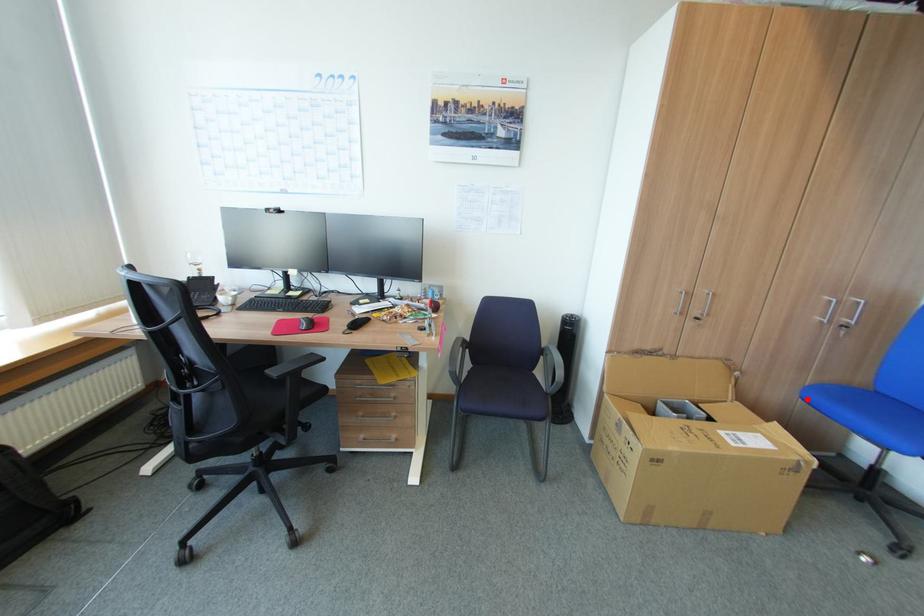
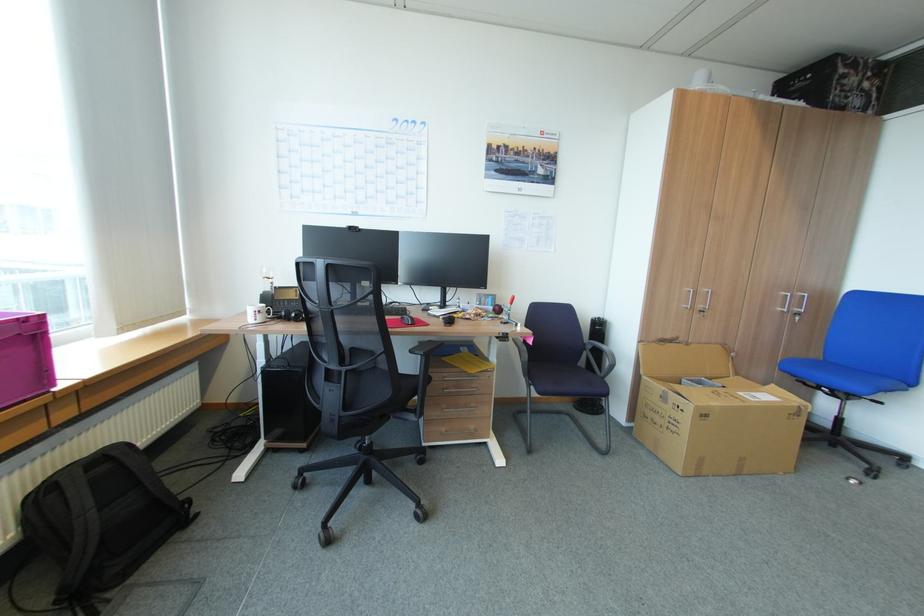
Question: I am providing you with two images of the same scene from different viewpoints. Given a red point in image1, look at the same physical point in image2. Is it:

Choices:
 (A) Closer to the viewpoint
 (B) Farther from the viewpoint

Answer: (B)